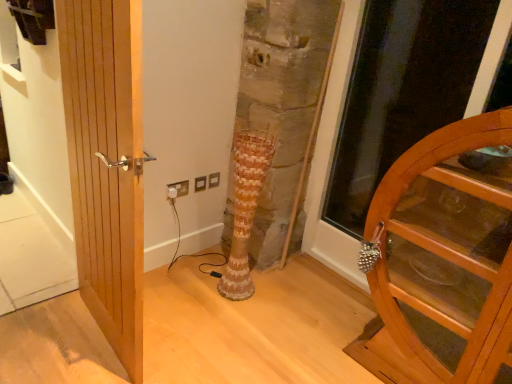
Where is `free space in front of brown textured vase at center`? free space in front of brown textured vase at center is located at coordinates (232, 318).